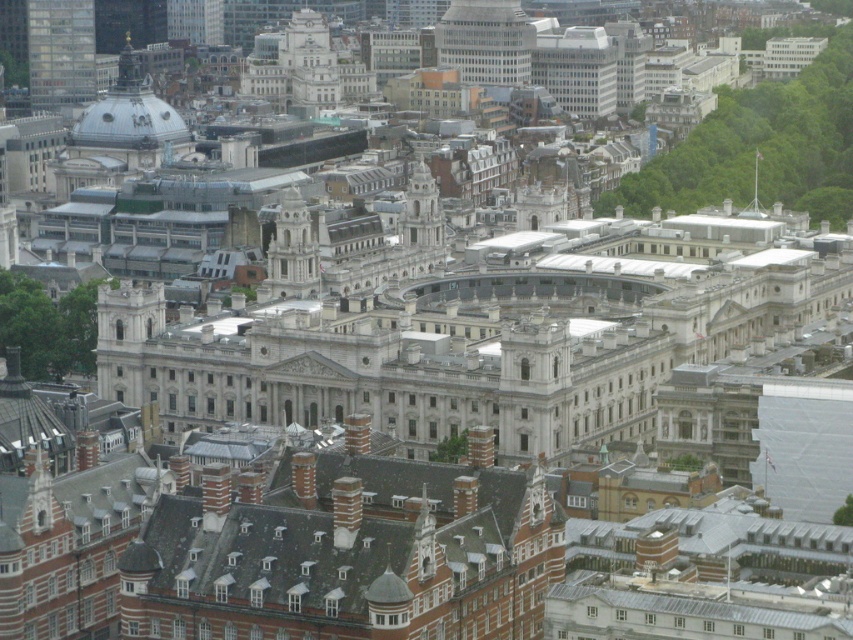
Question: Which point is closer to the camera taking this photo?

Choices:
 (A) (297, 259)
 (B) (518, 22)

Answer: (A)

Question: Does white glass tower at center have a lesser width compared to white stone tower at center?

Choices:
 (A) yes
 (B) no

Answer: (B)

Question: Does white glass tower at center appear under white stone tower at center?

Choices:
 (A) yes
 (B) no

Answer: (B)

Question: Can you confirm if white glass tower at center is positioned to the left of white stone tower at center?

Choices:
 (A) no
 (B) yes

Answer: (A)